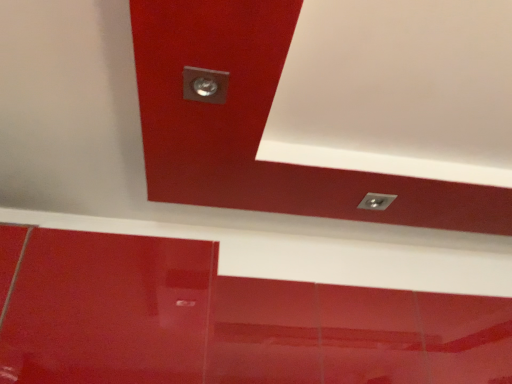
Describe the element at coordinates (398, 90) in the screenshot. I see `metallic silver exhaust hood at upper left` at that location.

In order to click on metallic silver exhaust hood at upper left in this screenshot , I will do `click(398, 90)`.

Image resolution: width=512 pixels, height=384 pixels. What are the coordinates of `metallic silver light fixture at upper right` in the screenshot? It's located at (376, 201).

What do you see at coordinates (376, 201) in the screenshot?
I see `metallic silver light fixture at upper right` at bounding box center [376, 201].

Identify the location of metallic silver exhaust hood at upper left. (398, 90).

In the image, is metallic silver light fixture at upper right on the left side or the right side of metallic silver exhaust hood at upper left?

Based on their positions, metallic silver light fixture at upper right is located to the right of metallic silver exhaust hood at upper left.

Between metallic silver light fixture at upper right and metallic silver exhaust hood at upper left, which one is positioned behind?

metallic silver light fixture at upper right is more distant.

Which point is more forward, (384, 207) or (480, 107)?

The point (480, 107) is closer.

From the image's perspective, is metallic silver light fixture at upper right on metallic silver exhaust hood at upper left?

Actually, metallic silver light fixture at upper right appears below metallic silver exhaust hood at upper left in the image.

From a real-world perspective, who is located higher, metallic silver light fixture at upper right or metallic silver exhaust hood at upper left?

metallic silver exhaust hood at upper left.

Considering the relative sizes of metallic silver light fixture at upper right and metallic silver exhaust hood at upper left in the image provided, is metallic silver light fixture at upper right wider than metallic silver exhaust hood at upper left?

No.

Which of these two, metallic silver light fixture at upper right or metallic silver exhaust hood at upper left, stands taller?

metallic silver exhaust hood at upper left is taller.

Is metallic silver light fixture at upper right bigger than metallic silver exhaust hood at upper left?

Incorrect, metallic silver light fixture at upper right is not larger than metallic silver exhaust hood at upper left.

Consider the image. Is metallic silver light fixture at upper right outside of metallic silver exhaust hood at upper left?

No, metallic silver light fixture at upper right is inside metallic silver exhaust hood at upper left's boundary.

Would you say metallic silver light fixture at upper right is a long distance from metallic silver exhaust hood at upper left?

No, metallic silver light fixture at upper right is in close proximity to metallic silver exhaust hood at upper left.

Could you tell me if metallic silver light fixture at upper right is turned towards metallic silver exhaust hood at upper left?

Yes, metallic silver light fixture at upper right is turned towards metallic silver exhaust hood at upper left.

How many degrees apart are the facing directions of metallic silver light fixture at upper right and metallic silver exhaust hood at upper left?

The angular difference between metallic silver light fixture at upper right and metallic silver exhaust hood at upper left is 89.2 degrees.

In order to click on exhaust hood that appears in front of the metallic silver light fixture at upper right in this screenshot , I will do `click(398, 90)`.

Which is more to the right, metallic silver exhaust hood at upper left or metallic silver light fixture at upper right?

From the viewer's perspective, metallic silver light fixture at upper right appears more on the right side.

Considering the positions of objects metallic silver exhaust hood at upper left and metallic silver light fixture at upper right in the image provided, who is behind, metallic silver exhaust hood at upper left or metallic silver light fixture at upper right?

metallic silver light fixture at upper right is further away from the camera.

Is point (439, 65) positioned after point (373, 203)?

No.

Looking at this image, from the image's perspective, is metallic silver exhaust hood at upper left positioned above or below metallic silver light fixture at upper right?

Clearly, from the image's perspective, metallic silver exhaust hood at upper left is above metallic silver light fixture at upper right.

From a real-world perspective, which object rests below the other?

In real-world perspective, metallic silver light fixture at upper right is lower.

Which of these two, metallic silver exhaust hood at upper left or metallic silver light fixture at upper right, is wider?

With larger width is metallic silver exhaust hood at upper left.

Considering the relative sizes of metallic silver exhaust hood at upper left and metallic silver light fixture at upper right in the image provided, is metallic silver exhaust hood at upper left taller than metallic silver light fixture at upper right?

Yes, metallic silver exhaust hood at upper left is taller than metallic silver light fixture at upper right.

Considering the sizes of metallic silver exhaust hood at upper left and metallic silver light fixture at upper right in the image, is metallic silver exhaust hood at upper left bigger or smaller than metallic silver light fixture at upper right?

In the image, metallic silver exhaust hood at upper left appears to be larger than metallic silver light fixture at upper right.

Do you think metallic silver exhaust hood at upper left is within metallic silver light fixture at upper right, or outside of it?

metallic silver exhaust hood at upper left is not inside metallic silver light fixture at upper right, it's outside.

Are metallic silver exhaust hood at upper left and metallic silver light fixture at upper right far apart?

They are positioned close to each other.

Is metallic silver light fixture at upper right at the back of metallic silver exhaust hood at upper left?

No, metallic silver exhaust hood at upper left is not facing away from metallic silver light fixture at upper right.

Locate an element on the screen. exhaust hood above the metallic silver light fixture at upper right (from a real-world perspective) is located at coordinates (398, 90).

Find the location of a particular element. The image size is (512, 384). exhaust hood on the left of the metallic silver light fixture at upper right is located at coordinates (398, 90).

Identify the location of knob on the right side of metallic silver exhaust hood at upper left. (376, 201).